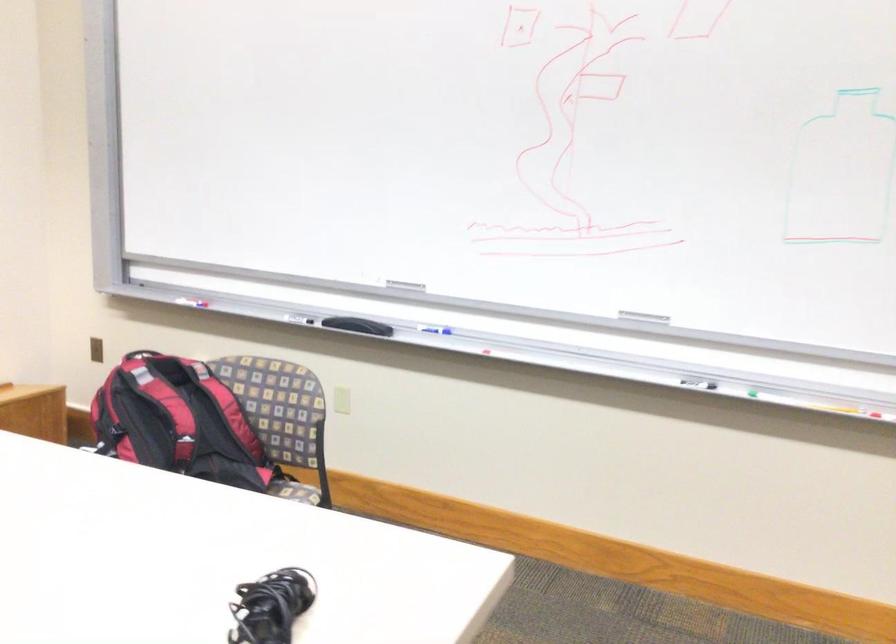
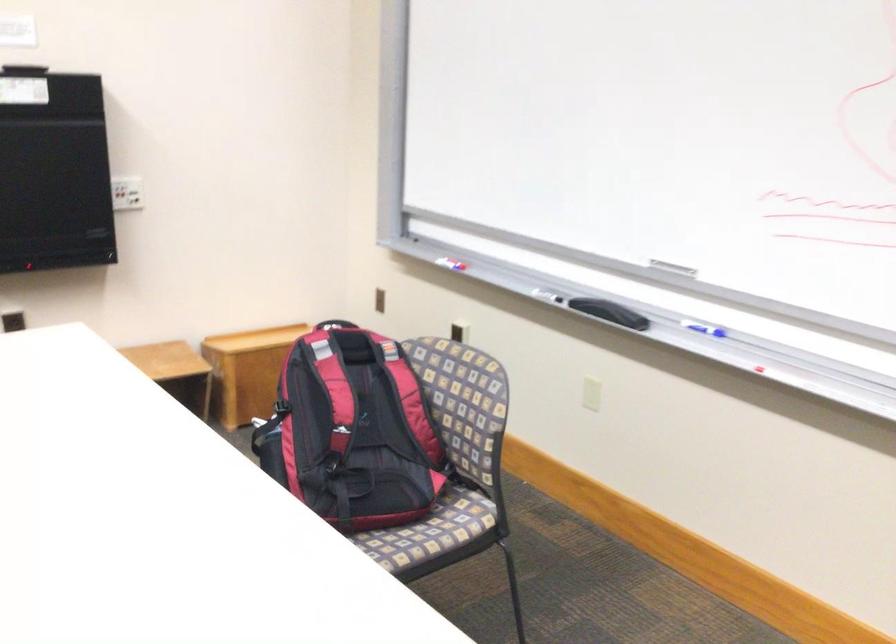
Locate, in the second image, the point that corresponds to [401,281] in the first image.

(672, 267)